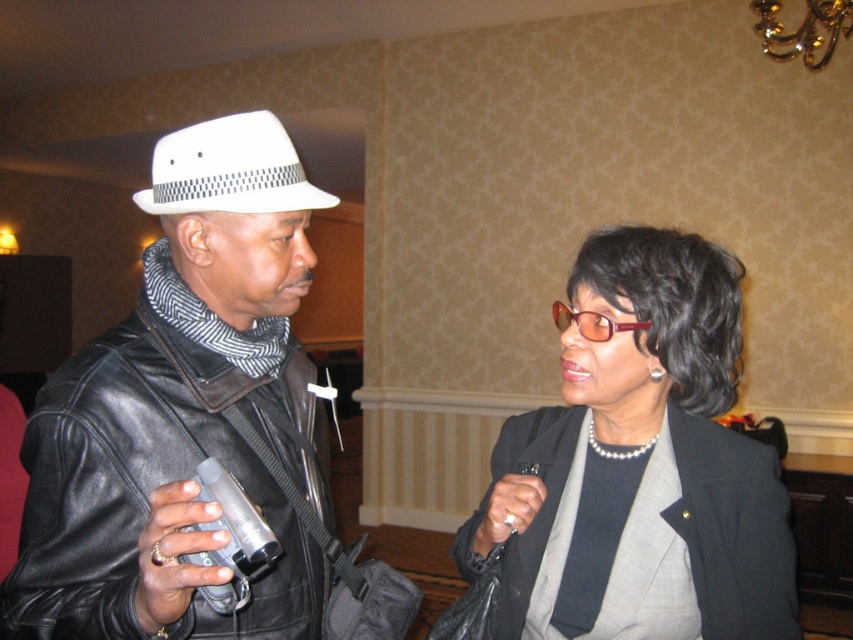
You are an interior designer analyzing the spatial layout of this room. You need to place a decorative item exactly at the center of the room. However, you notice the pearl necklace at center is already positioned there. Where should you place your decorative item instead?

Since the pearl necklace at center is already at the center point, you should place your decorative item elsewhere, perhaps slightly to the side or another focal area of the room to avoid overlapping.

You are trying to determine which item is narrower between the matte black leather jacket at left and the white felt fedora at left. Based on the scene, which one is narrower?

The matte black leather jacket at left is narrower than the white felt fedora at left.

You are standing in the room where the two people are talking. You want to place a small plant between the two points marked as point (90, 628) and point (596, 486). Which point should the plant be closer to so it is positioned in front of the other point?

The plant should be closer to point (90, 628) because it is in front of point (596, 486).